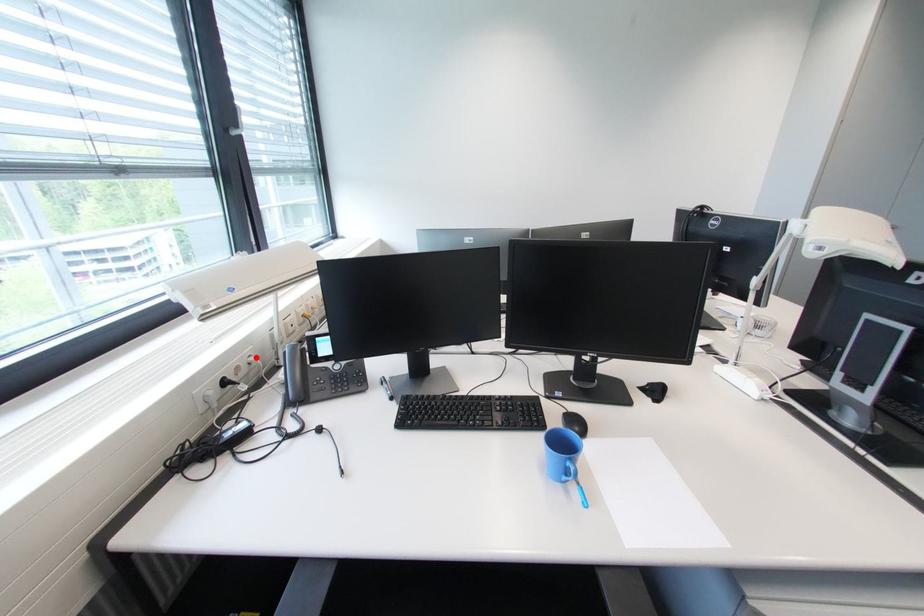
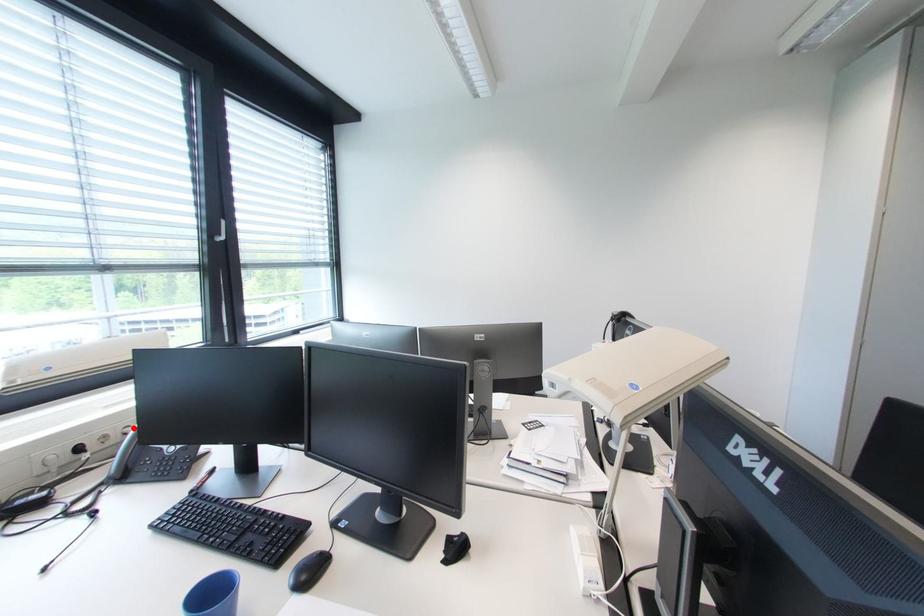
I am providing you with two images of the same scene from different viewpoints. A red point is marked on the first image and another point is marked on the second image. Is the marked point in image1 the same physical position as the marked point in image2?

Yes